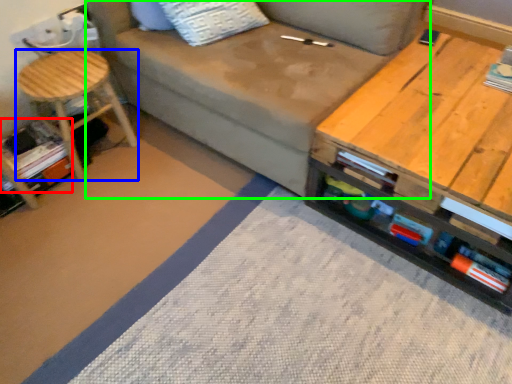
Question: Which is farther away from book (highlighted by a red box)? stool (highlighted by a blue box) or studio couch (highlighted by a green box)?

Choices:
 (A) stool
 (B) studio couch

Answer: (B)